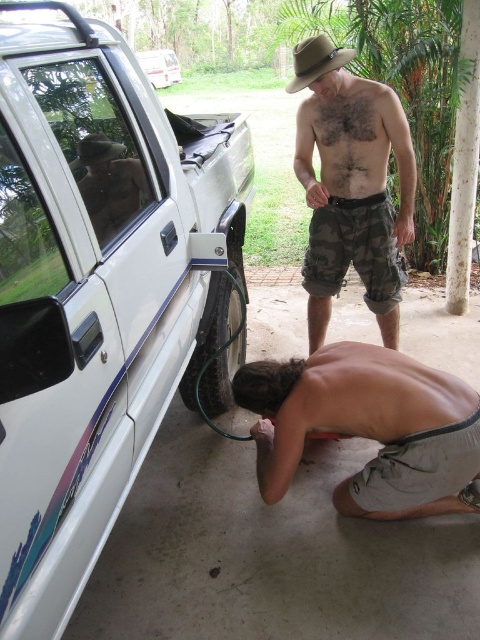
You are a photographer setting up a tripod to take a photo of the white plastic car at upper left and the brown felt fedora at upper left. Since you want both objects to appear clearly in the frame, which object should you focus on first to ensure proper depth of field?

The white plastic car at upper left is larger in size compared to the brown felt fedora at upper left, so focusing on the white plastic car at upper left first will help ensure both objects are in focus due to its larger size requiring more precise focus.

Where is the brown felt fedora at upper center located in the image?

The brown felt fedora at upper center is located at point (315,60) in the image.